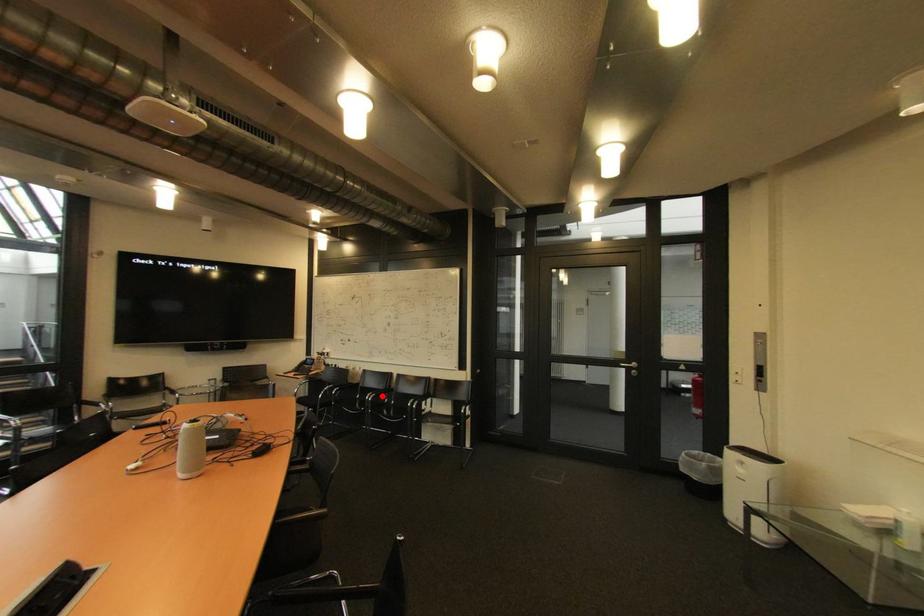
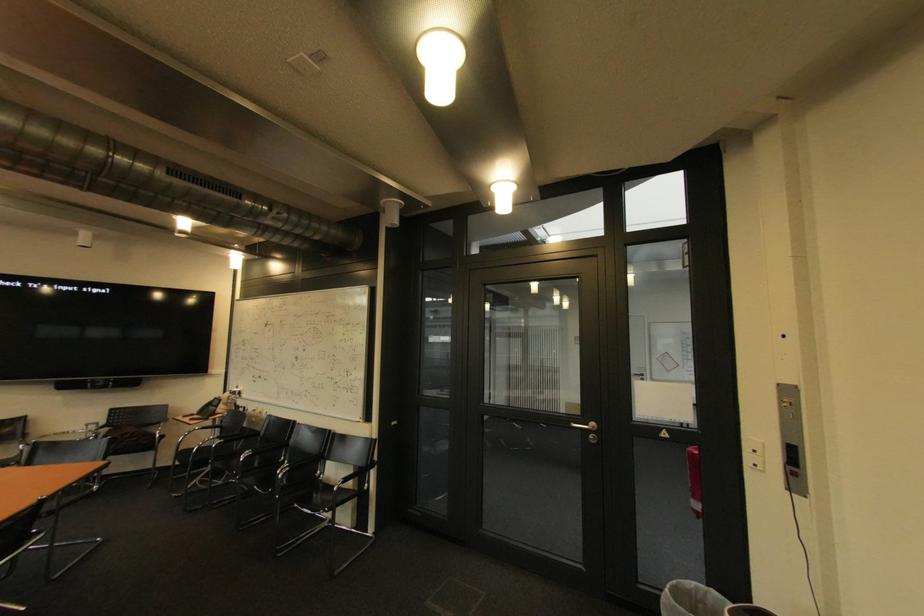
Find the pixel in the second image that matches the highlighted location in the first image.

(259, 455)